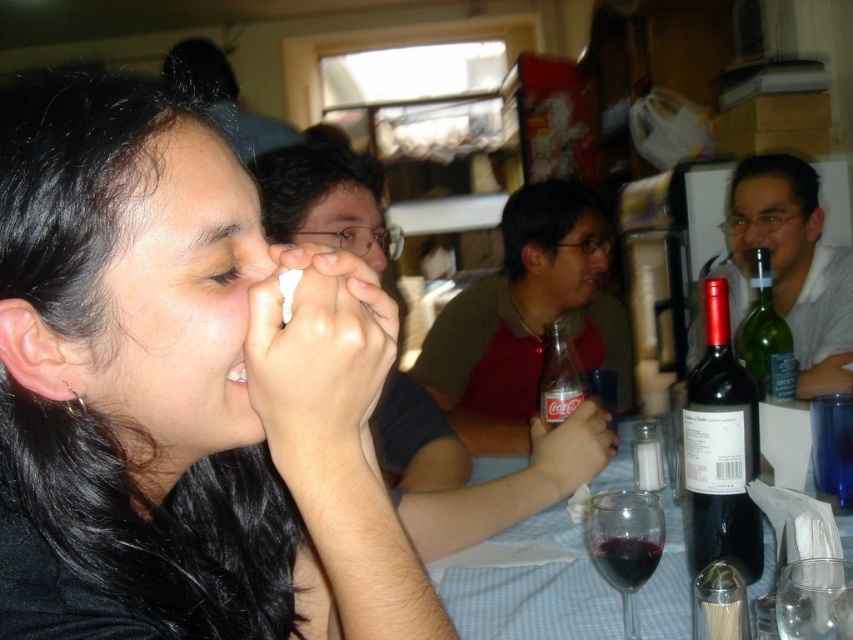
Can you confirm if black matte hair at upper left is thinner than transparent glass at lower center?

In fact, black matte hair at upper left might be wider than transparent glass at lower center.

Where is `black matte hair at upper left`? black matte hair at upper left is located at coordinates 187,378.

Which is more to the left, black matte wine bottle at right or transparent glass at lower center?

Positioned to the left is transparent glass at lower center.

This screenshot has height=640, width=853. What do you see at coordinates (720, 449) in the screenshot?
I see `black matte wine bottle at right` at bounding box center [720, 449].

Locate an element on the screen. black matte wine bottle at right is located at coordinates (720, 449).

Does black matte wine bottle at right come in front of transparent glass at lower right?

No, it is behind transparent glass at lower right.

Is point (717, 500) farther from camera compared to point (833, 564)?

Yes, it is behind point (833, 564).

Is point (715, 404) less distant than point (817, 566)?

No, (715, 404) is behind (817, 566).

You are a GUI agent. You are given a task and a screenshot of the screen. Output one action in this format:
    pyautogui.click(x=<x>, y=<y>)
    Task: Click on the black matte wine bottle at right
    The height and width of the screenshot is (640, 853).
    Given the screenshot: What is the action you would take?
    pyautogui.click(x=720, y=449)